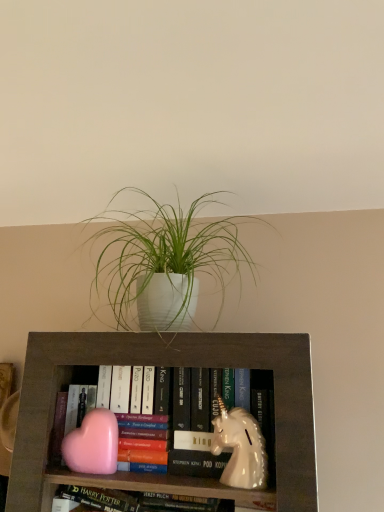
Question: From the image's perspective, is white glossy unicorn at center, which is counted as the second animal, starting from the left, positioned above or below white matte plant pot at upper center?

Choices:
 (A) below
 (B) above

Answer: (A)

Question: Is white glossy unicorn at center, which is counted as the second animal, starting from the left, to the left or to the right of white matte plant pot at upper center in the image?

Choices:
 (A) left
 (B) right

Answer: (B)

Question: Which of these objects is positioned closest to the white glossy unicorn at center, the 1th animal viewed from the right?

Choices:
 (A) pink matte heart at lower left, the first animal positioned from the left
 (B) white matte plant pot at upper center

Answer: (A)

Question: Which object is positioned closest to the pink matte heart at lower left, the second animal in the right-to-left sequence?

Choices:
 (A) white glossy unicorn at center, which is counted as the second animal, starting from the left
 (B) white matte plant pot at upper center

Answer: (A)